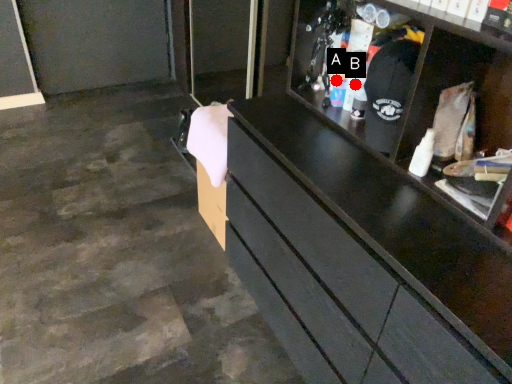
Question: Two points are circled on the image, labeled by A and B beside each circle. Which point is closer to the camera taking this photo?

Choices:
 (A) A is closer
 (B) B is closer

Answer: (B)